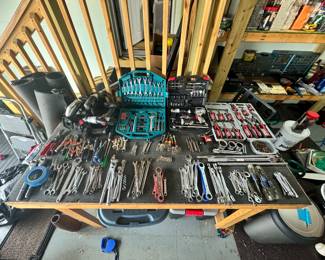
Where is `handrail`? handrail is located at coordinates (19, 33).